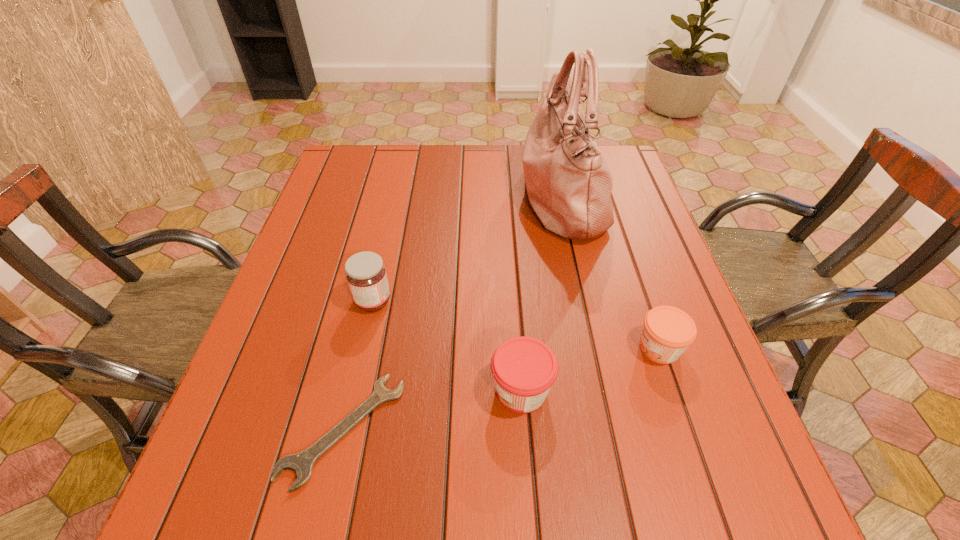
You are a GUI agent. You are given a task and a screenshot of the screen. Output one action in this format:
    pyautogui.click(x=<x>, y=<y>)
    Task: Click on the vacant space at the far left corner of the desktop
    The height and width of the screenshot is (540, 960).
    Given the screenshot: What is the action you would take?
    pyautogui.click(x=344, y=185)

In the image, there is a desktop. Identify the location of vacant space at the far right corner. (620, 162).

Image resolution: width=960 pixels, height=540 pixels. Identify the location of empty space that is in between the second shortest jam and the farthest jam. (447, 346).

I want to click on unoccupied position between the wrench and the tallest jam, so [x=358, y=365].

Find the location of `free space between the leftmost jam and the second jam from left to right`. free space between the leftmost jam and the second jam from left to right is located at coordinates point(447,346).

You are a GUI agent. You are given a task and a screenshot of the screen. Output one action in this format:
    pyautogui.click(x=<x>, y=<y>)
    Task: Click on the empty location between the second tallest object and the shortest object
    Image resolution: width=960 pixels, height=540 pixels.
    Given the screenshot: What is the action you would take?
    pyautogui.click(x=358, y=365)

I want to click on free space between the wrench and the handbag, so click(x=452, y=313).

The width and height of the screenshot is (960, 540). Find the location of `vacant space in between the third tallest object and the rightmost jam`. vacant space in between the third tallest object and the rightmost jam is located at coordinates (590, 369).

Locate an element on the screen. empty space that is in between the third tallest object and the tallest jam is located at coordinates (447, 346).

This screenshot has height=540, width=960. I want to click on free space between the second jam from right to left and the farthest object, so click(x=541, y=294).